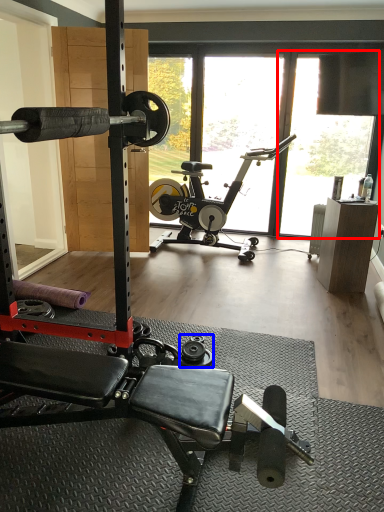
Question: Which point is closer to the camera, window screen (highlighted by a red box) or dumbbell (highlighted by a blue box)?

Choices:
 (A) window screen
 (B) dumbbell

Answer: (B)